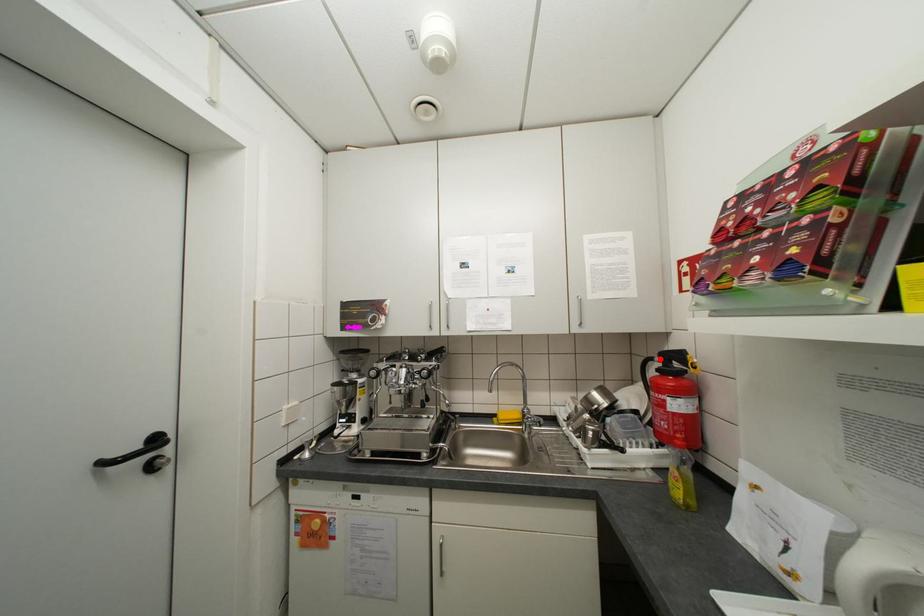
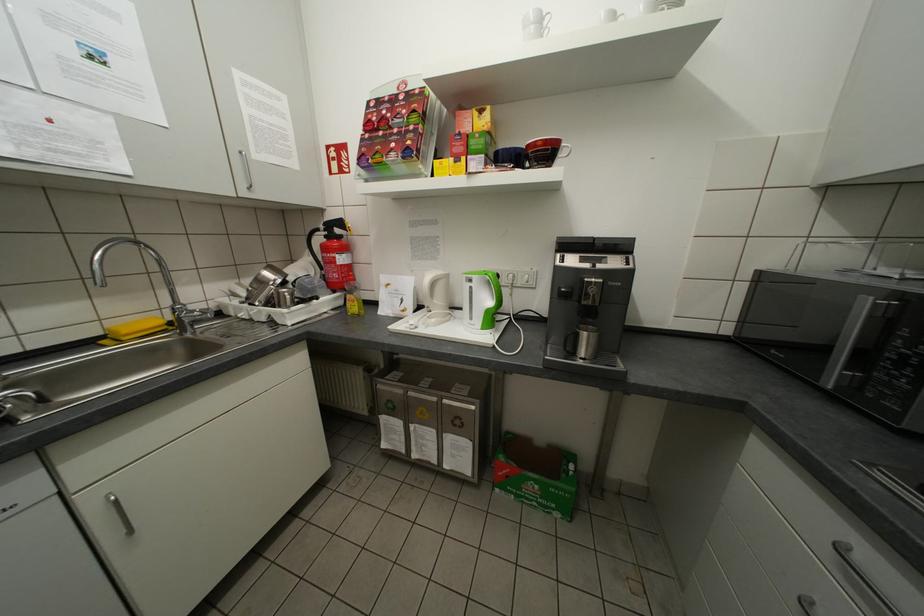
Where in the second image is the point corresponding to the highlighted location from the first image?

(325, 230)